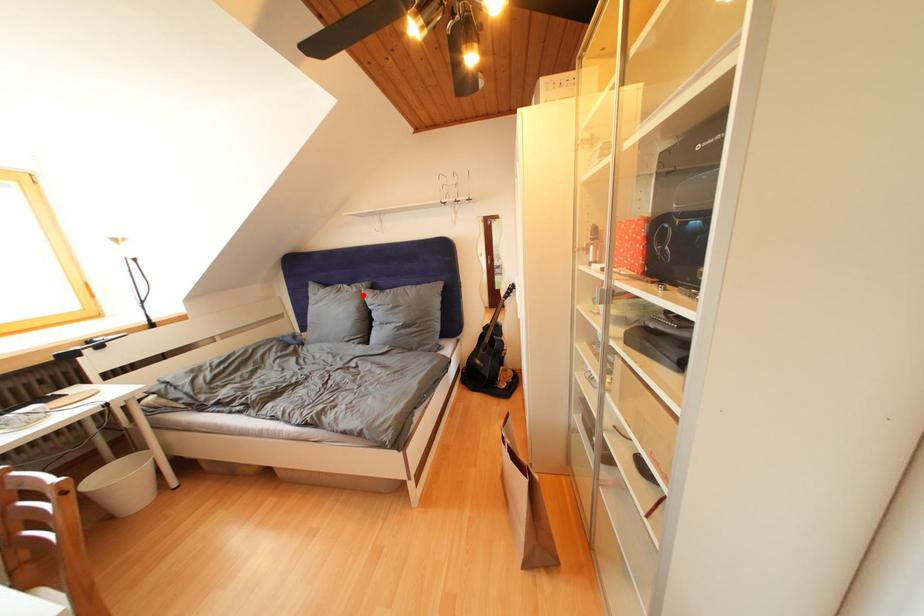
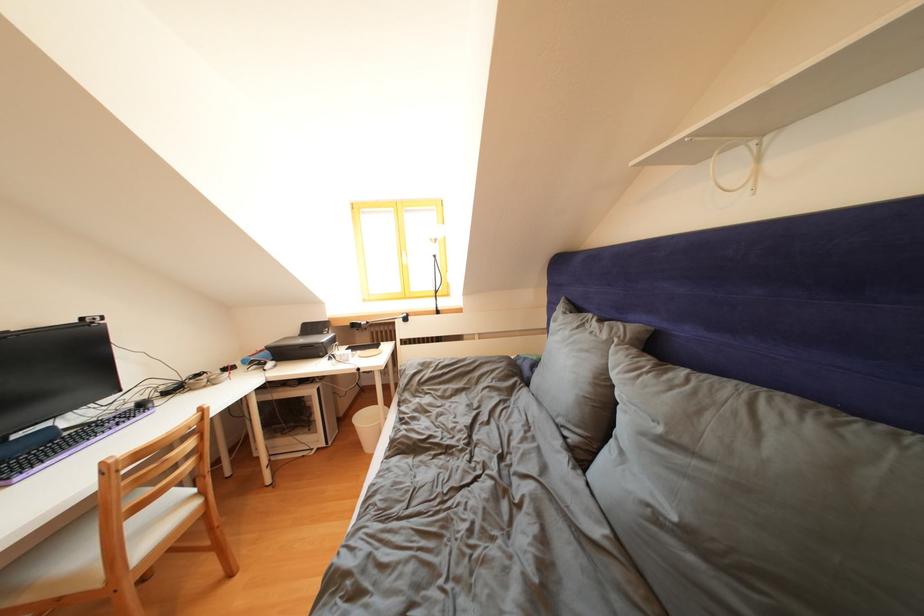
Locate, in the second image, the point that corresponds to the highlighted location in the first image.

(612, 341)